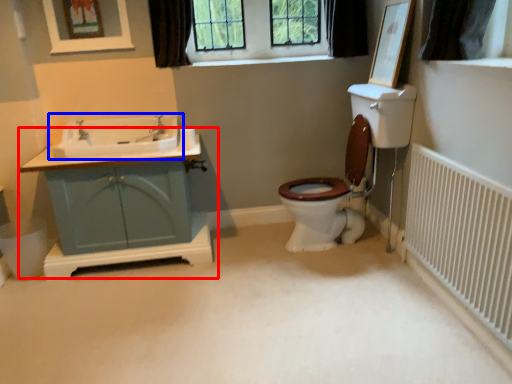
Question: Among these objects, which one is farthest to the camera, bathroom cabinet (highlighted by a red box) or sink (highlighted by a blue box)?

Choices:
 (A) bathroom cabinet
 (B) sink

Answer: (B)